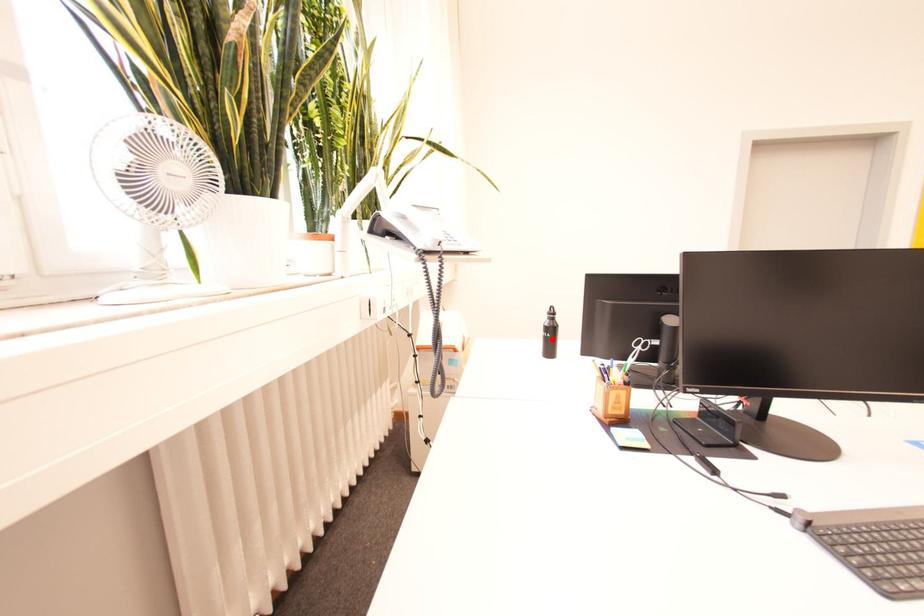
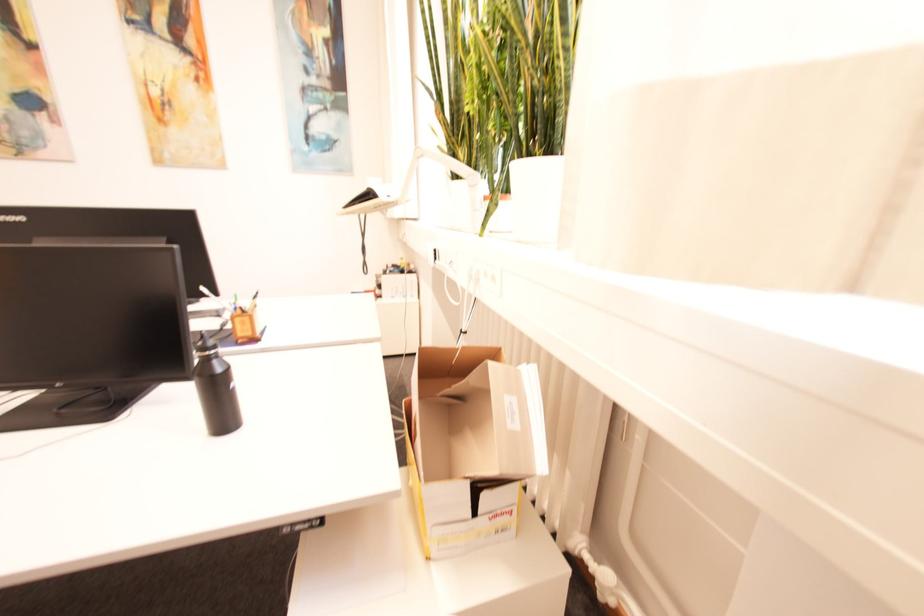
Question: I am providing you with two images of the same scene from different viewpoints. A red point is marked on the first image. Can you still see the location of the red point in image 2?

Choices:
 (A) Yes
 (B) No

Answer: (B)